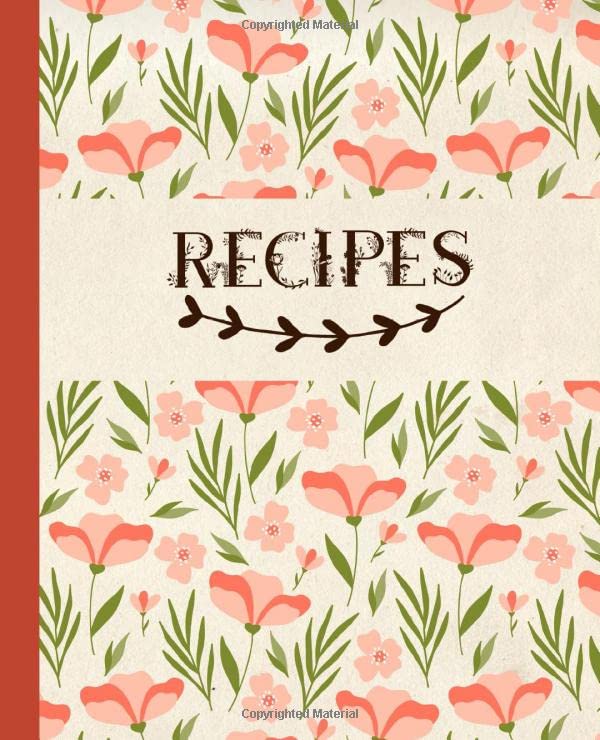
The width and height of the screenshot is (600, 740). I want to click on recipe book, so click(491, 374).